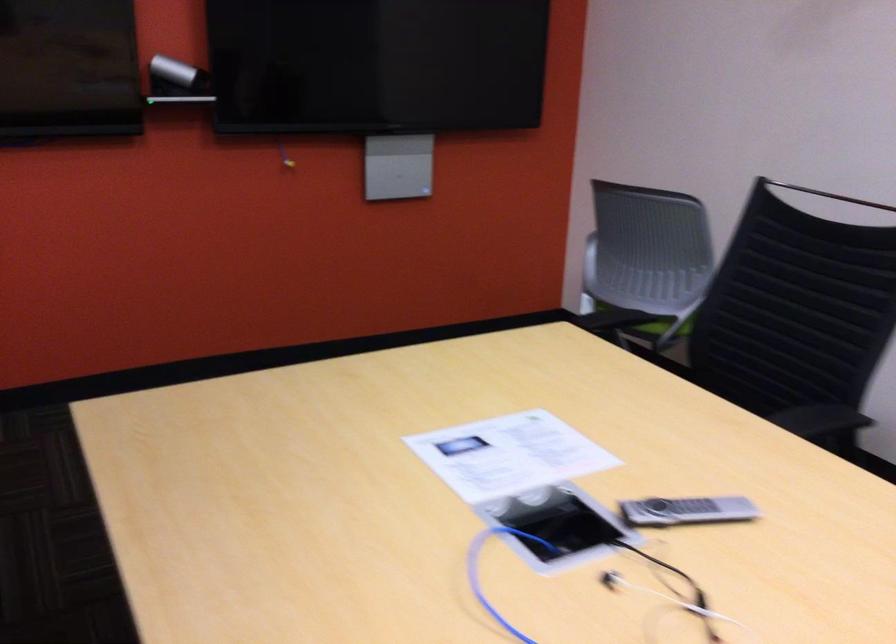
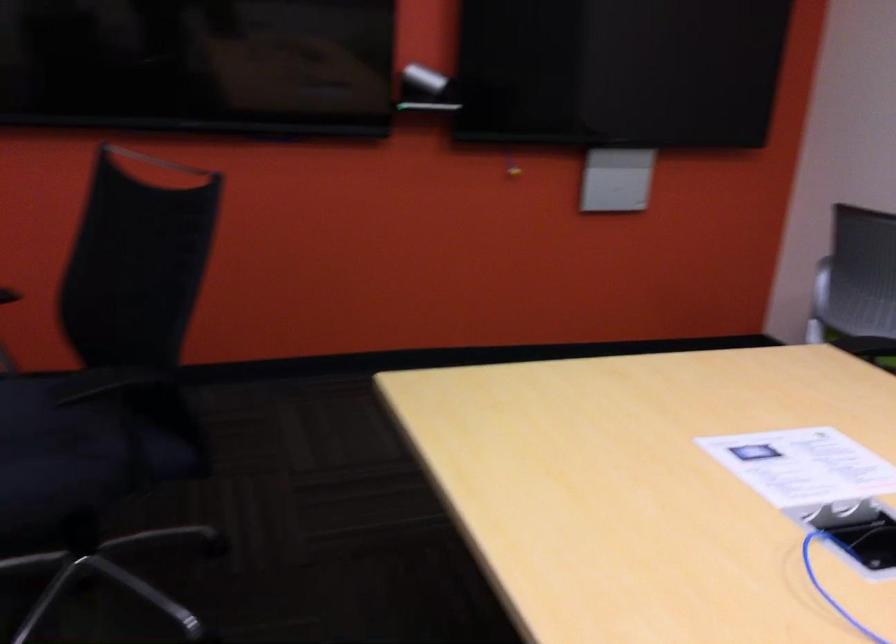
Question: Which direction would the cameraman need to move to produce the second image? Reply with the corresponding letter.

Choices:
 (A) Left
 (B) Right
 (C) Forward
 (D) Backward

Answer: (A)